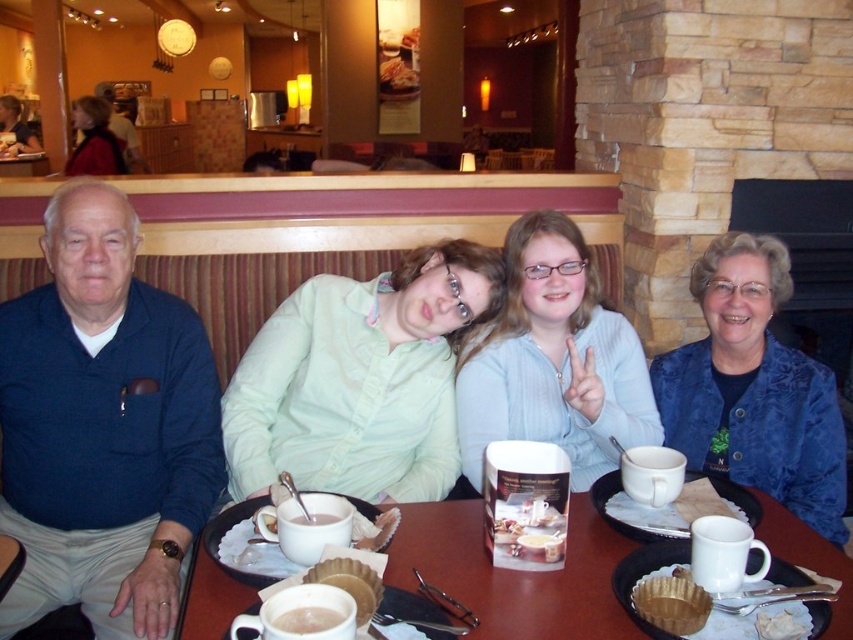
You are a barista at the restaurant and need to serve a customer who ordered both the white ceramic mug at center and the white crumbly pastry at center. Which item should you place first on the tray to ensure stability?

The white ceramic mug at center should be placed first on the tray because it is bigger than the white crumbly pastry at center, providing a stable base for the smaller pastry to be placed on top or beside without tipping over.

You are sitting at a table in a cozy restaurant. You notice two points marked on the floor. The first point is at coordinate point [643,636] and the second is at point [259,621]. If you are facing the entrance of the restaurant, which point is located behind the other?

Point [643,636] is behind point [259,621] when facing the entrance of the restaurant.

Consider the image. You are a server at the restaurant and need to deliver a white ceramic mug at center to the customer seated at the table. The customer is 3.65 feet away from the mug. Can you reach the mug without moving your position?

The customer is 3.65 feet away from the white ceramic mug at center. Since the distance is 3.65 feet, you can reach the mug without needing to move your position if your reach extends that far, but typically, this might require stretching. However, the answer depends on the server reaching capability.